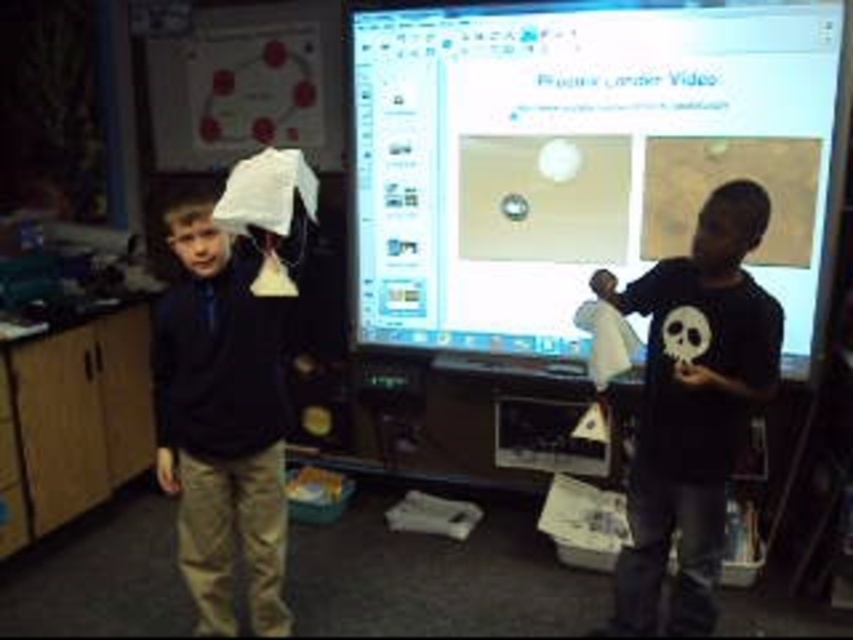
You are a student in the classroom and need to present your slide. The white glossy monitor at center and the matte black jacket at left are in your way. Which object is wider so you can move it aside first?

The white glossy monitor at center is wider than the matte black jacket at left, so you should move the white glossy monitor at center first.

You are a photographer in the classroom and want to take a photo of both the matte black jacket at left and the black matte shirt at right. Which object should you focus on first to ensure both are in sharp focus?

You should focus on the matte black jacket at left first because it is closer to you than the black matte shirt at right, ensuring both will be in focus when using a shallow depth of field.

You are a student in the classroom and want to look at the white glossy monitor at center. Where should you look on the screen?

The white glossy monitor at center is located at the 2D coordinates point (582, 157).